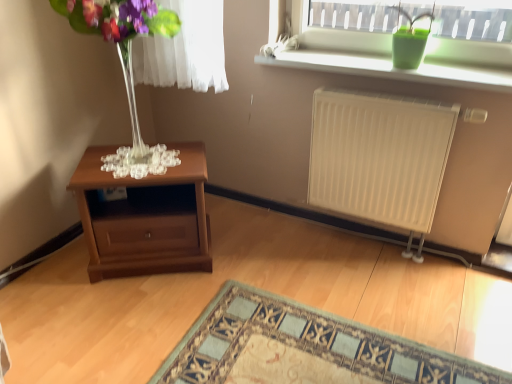
You are a GUI agent. You are given a task and a screenshot of the screen. Output one action in this format:
    pyautogui.click(x=<x>, y=<y>)
    Task: Click on the free space above carpet with intricate pattern at lower center (from a real-world perspective)
    
    Given the screenshot: What is the action you would take?
    pyautogui.click(x=310, y=354)